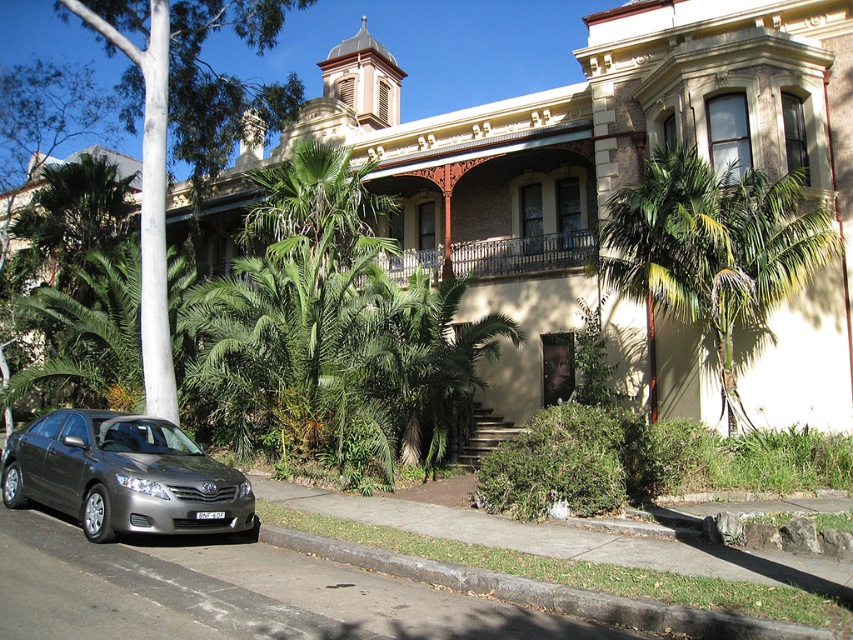
Question: Is green leafy palm tree at center bigger than gray concrete curb at lower center?

Choices:
 (A) no
 (B) yes

Answer: (B)

Question: Which of the following is the closest to the observer?

Choices:
 (A) green leafy tree at center
 (B) satin silver sedan at lower left
 (C) gray concrete curb at lower center
 (D) green leafy palm tree at center

Answer: (C)

Question: Which object is positioned farthest from the green leafy palm tree at center?

Choices:
 (A) gray concrete curb at lower center
 (B) satin silver sedan at lower left
 (C) green leafy tree at center

Answer: (C)

Question: Observing the image, what is the correct spatial positioning of green leafy palm tree at center in reference to gray concrete curb at lower center?

Choices:
 (A) right
 (B) left

Answer: (A)

Question: Which point is closer to the camera taking this photo?

Choices:
 (A) (83, 451)
 (B) (73, 12)
 (C) (608, 216)
 (D) (701, 636)

Answer: (D)

Question: Does green leafy tree at center lie behind satin silver sedan at lower left?

Choices:
 (A) no
 (B) yes

Answer: (B)